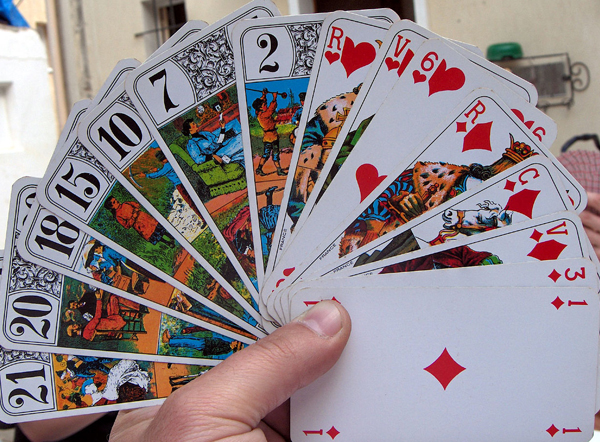
You are a GUI agent. You are given a task and a screenshot of the screen. Output one action in this format:
    pyautogui.click(x=<x>, y=<y>)
    Task: Click on the frame
    
    Given the screenshot: What is the action you would take?
    pyautogui.click(x=570, y=76)